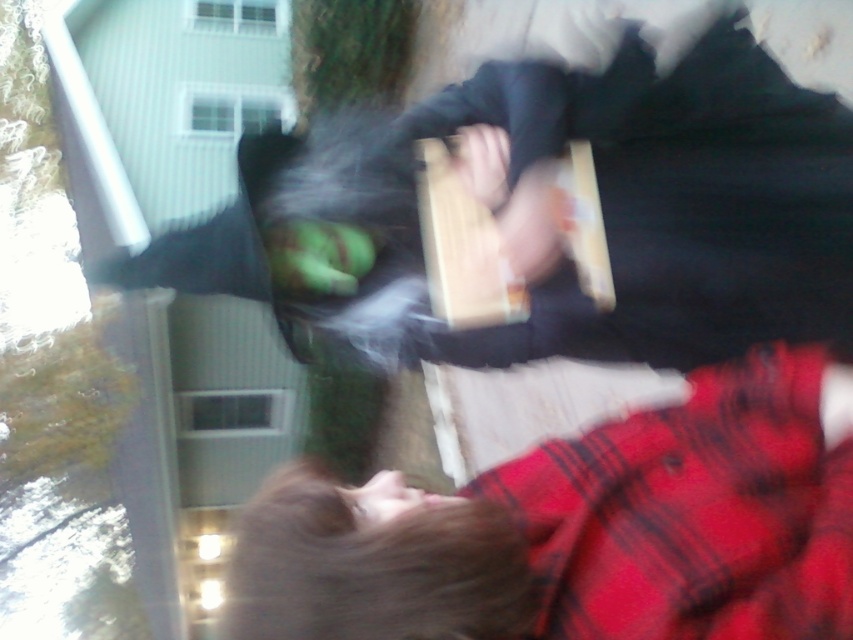
Question: Considering the relative positions of matte black jacket at upper center and flannel shirt at lower right in the image provided, where is matte black jacket at upper center located with respect to flannel shirt at lower right?

Choices:
 (A) below
 (B) above

Answer: (B)

Question: Can you confirm if matte black jacket at upper center is wider than flannel shirt at lower right?

Choices:
 (A) yes
 (B) no

Answer: (A)

Question: Which of the following is the closest to the observer?

Choices:
 (A) flannel shirt at lower right
 (B) matte black jacket at upper center

Answer: (A)

Question: Among these points, which one is farthest from the camera?

Choices:
 (A) (740, 68)
 (B) (457, 502)

Answer: (A)

Question: Does matte black jacket at upper center appear on the left side of flannel shirt at lower right?

Choices:
 (A) no
 (B) yes

Answer: (B)